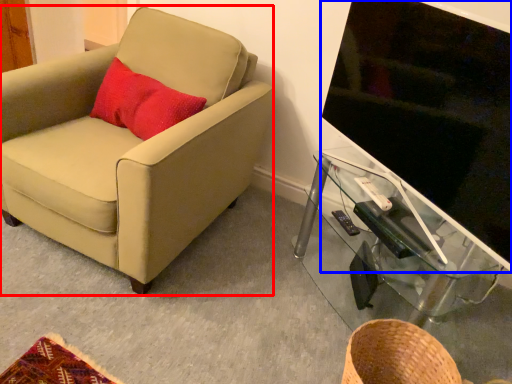
Question: Which of the following is the farthest to the observer, chair (highlighted by a red box) or television (highlighted by a blue box)?

Choices:
 (A) chair
 (B) television

Answer: (A)